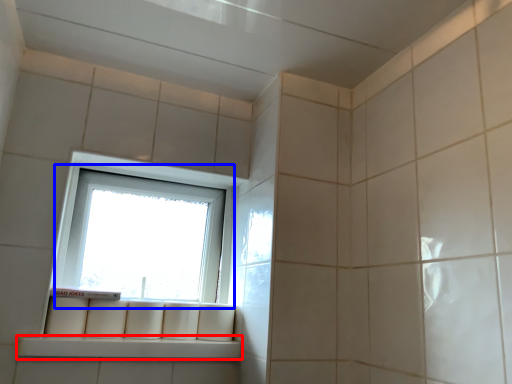
Question: Which object is closer to the camera taking this photo, window sill (highlighted by a red box) or window (highlighted by a blue box)?

Choices:
 (A) window sill
 (B) window

Answer: (A)